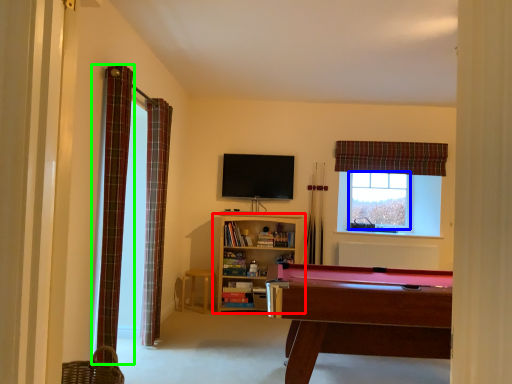
Question: Based on their relative distances, which object is nearer to shelf (highlighted by a red box)? Choose from window screen (highlighted by a blue box) and curtain (highlighted by a green box).

Choices:
 (A) window screen
 (B) curtain

Answer: (A)